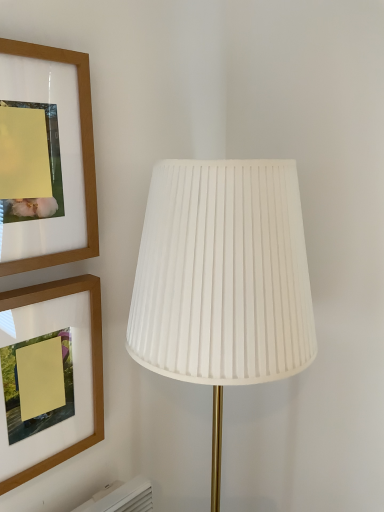
Question: From a real-world perspective, relative to white pleated fabric lamp at center, is wooden picture frame at upper left, which is the second picture frame from top to bottom, vertically above or below?

Choices:
 (A) above
 (B) below

Answer: (A)

Question: Based on their positions, is wooden picture frame at upper left, which is the second picture frame from top to bottom, located to the left or right of white pleated fabric lamp at center?

Choices:
 (A) left
 (B) right

Answer: (A)

Question: Which is farther from the wooden picture frame at upper left, which is the second picture frame from bottom to top?

Choices:
 (A) wooden picture frame at upper left, the first picture frame in the bottom-to-top sequence
 (B) white pleated fabric lamp at center

Answer: (B)

Question: Based on their relative distances, which object is farther from the white pleated fabric lamp at center?

Choices:
 (A) wooden picture frame at upper left, marked as the 1th picture frame in a top-to-bottom arrangement
 (B) wooden picture frame at upper left, which is the second picture frame from top to bottom

Answer: (B)